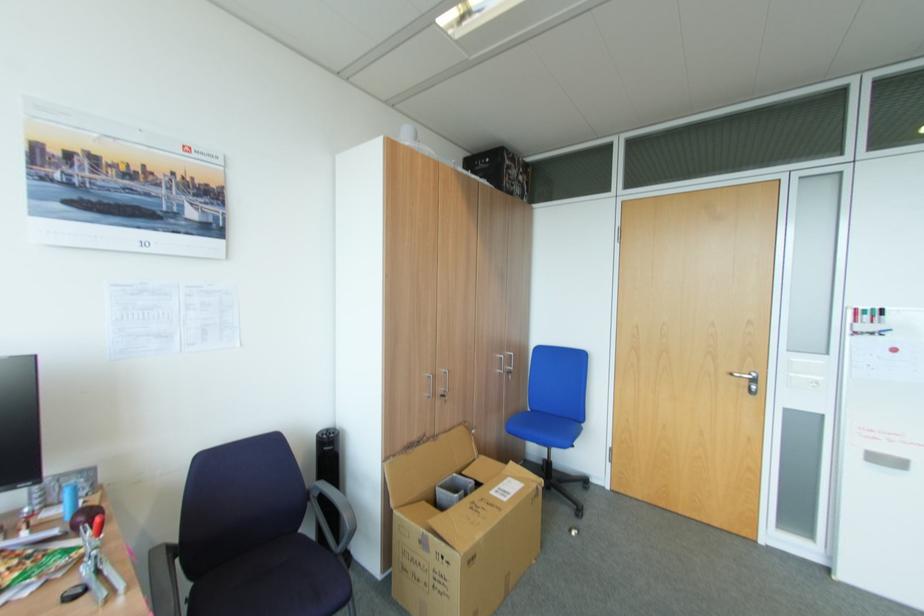
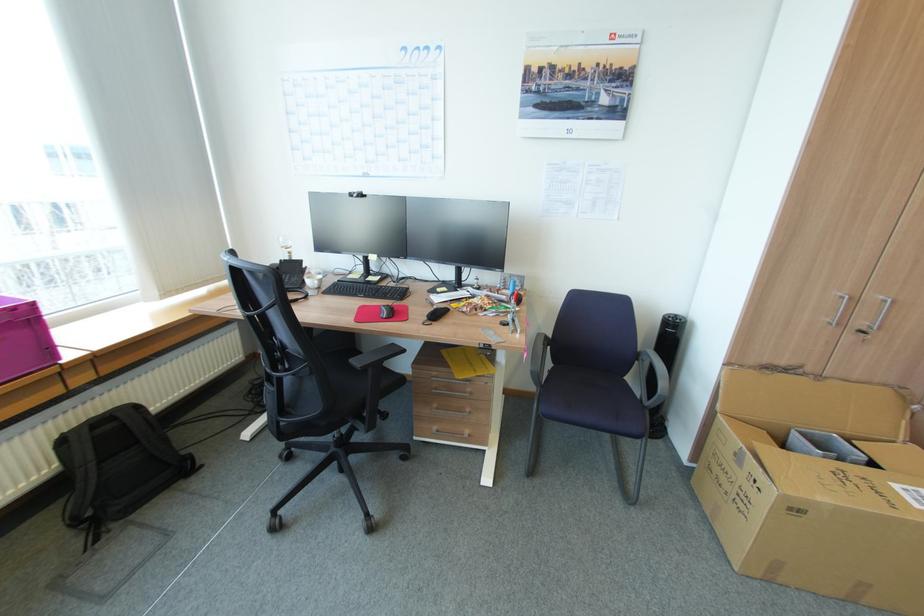
Based on the continuous images, in which direction is the camera rotating?

The camera rotated toward left-down.